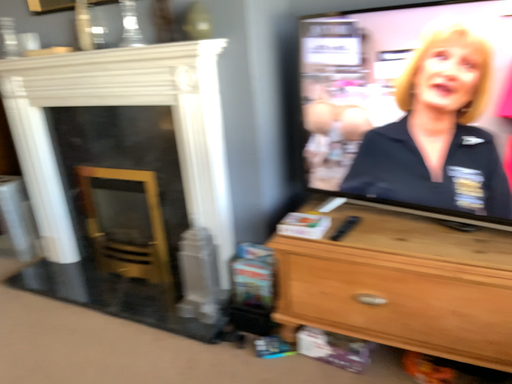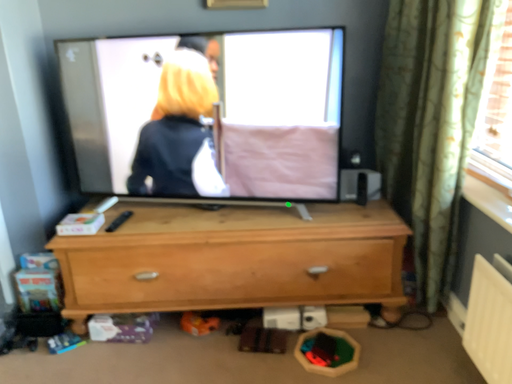
Question: How did the camera likely rotate when shooting the video?

Choices:
 (A) rotated right
 (B) rotated left

Answer: (A)